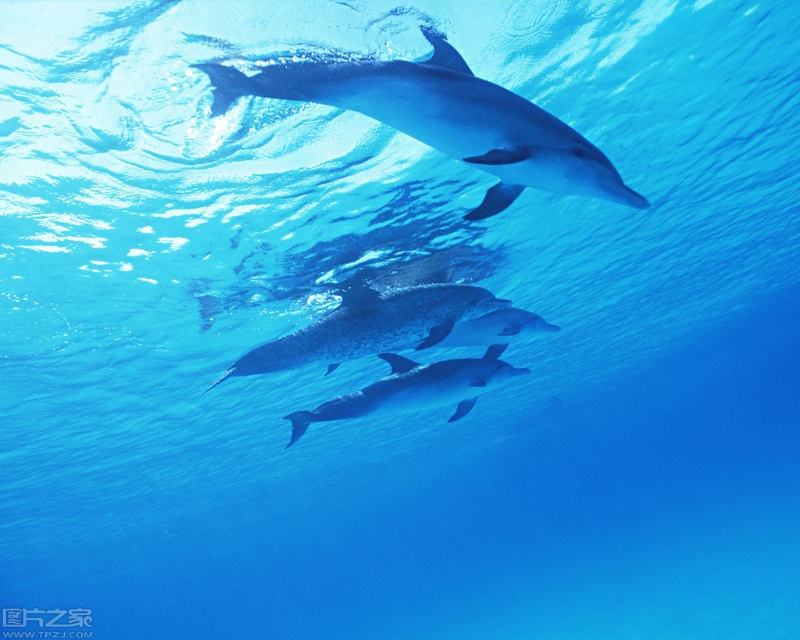
Question: Can you confirm if glossy white dolphin at center is thinner than glossy blue dolphin at center?

Choices:
 (A) yes
 (B) no

Answer: (B)

Question: Estimate the real-world distances between objects in this image. Which object is farther from the glossy white dolphin at center?

Choices:
 (A) speckled blue dolphin at center
 (B) glossy blue dolphin at center

Answer: (A)

Question: Can you confirm if glossy white dolphin at center is bigger than glossy blue dolphin at center?

Choices:
 (A) yes
 (B) no

Answer: (A)

Question: Does sleek silver dolphin at upper center have a smaller size compared to speckled blue dolphin at center?

Choices:
 (A) yes
 (B) no

Answer: (A)

Question: Among these points, which one is farthest from the camera?

Choices:
 (A) click(x=500, y=332)
 (B) click(x=452, y=58)

Answer: (A)

Question: Which point appears farthest from the camera in this image?

Choices:
 (A) (245, 355)
 (B) (332, 413)
 (C) (510, 99)

Answer: (B)